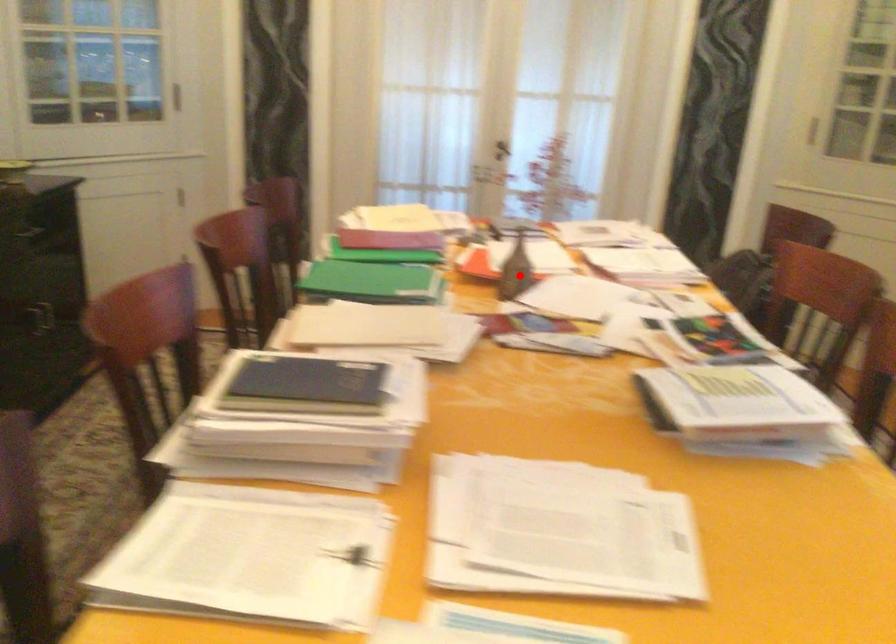
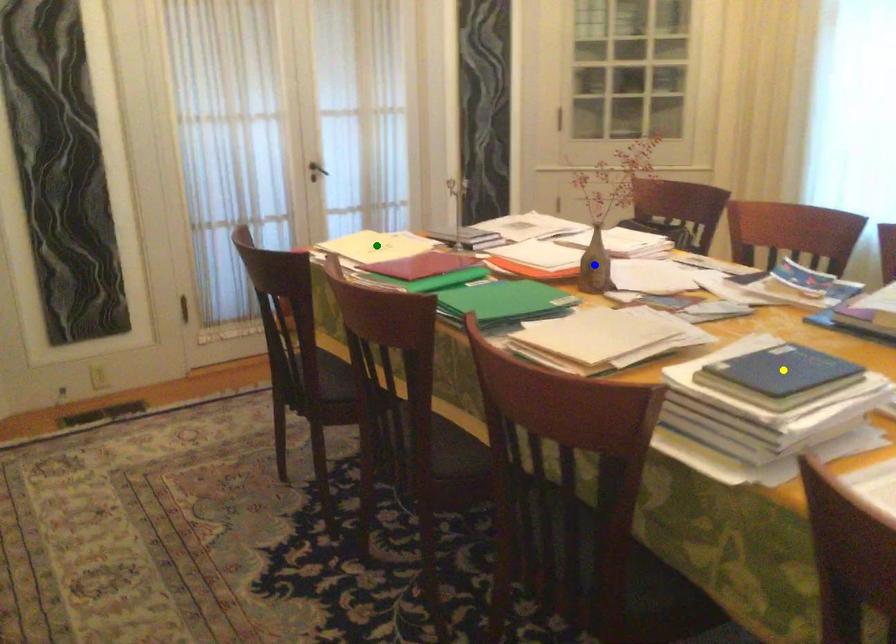
Question: I am providing you with two images of the same scene from different viewpoints. A red point is marked on the first image. You are given multiple points on the second image. Which point in image 2 represents the same 3d spot as the red point in image 1?

Choices:
 (A) green point
 (B) blue point
 (C) yellow point

Answer: (B)